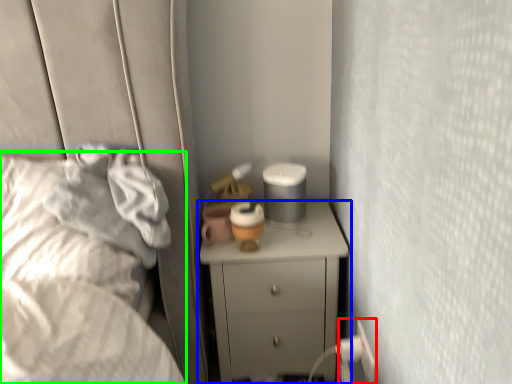
Question: Considering the real-world distances, which object is closest to electric outlet (highlighted by a red box)? chest of drawers (highlighted by a blue box) or bed (highlighted by a green box).

Choices:
 (A) chest of drawers
 (B) bed

Answer: (A)